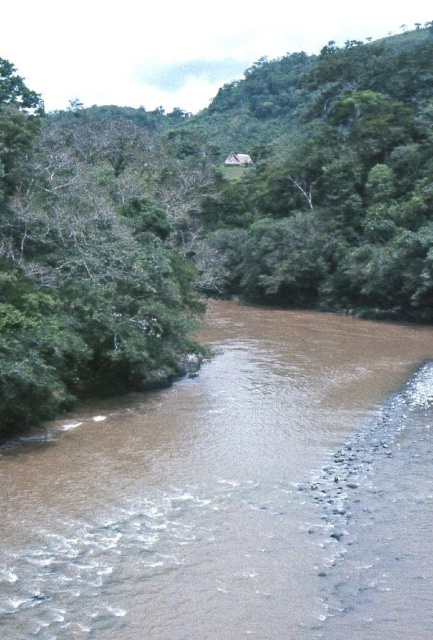
Question: Can you confirm if green leafy tree at center is wider than green leafy tree at left?

Choices:
 (A) no
 (B) yes

Answer: (B)

Question: Which point appears farthest from the camera in this image?

Choices:
 (A) (81, 550)
 (B) (177, 241)
 (C) (6, 378)

Answer: (B)

Question: Does brown muddy water at center have a larger size compared to green leafy tree at left?

Choices:
 (A) yes
 (B) no

Answer: (B)

Question: Among these points, which one is nearest to the camera?

Choices:
 (A) (252, 148)
 (B) (64, 516)
 (C) (29, 100)

Answer: (B)

Question: Which point is farther from the camera taking this photo?

Choices:
 (A) (12, 77)
 (B) (233, 472)

Answer: (A)

Question: Is green leafy tree at center further to the viewer compared to green leafy tree at left?

Choices:
 (A) no
 (B) yes

Answer: (B)